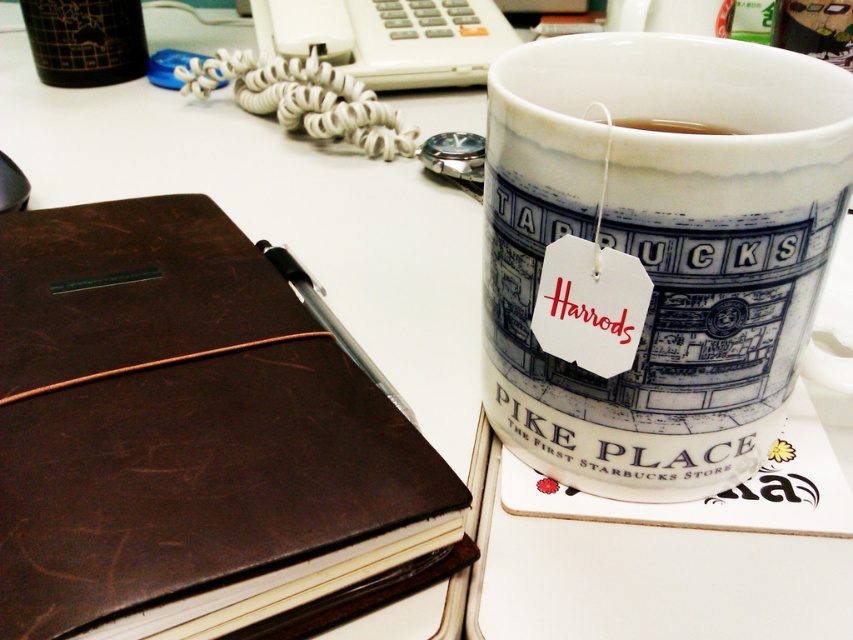
Can you confirm if brown leather notebook at left is shorter than white ceramic mug at upper right?

Yes, brown leather notebook at left is shorter than white ceramic mug at upper right.

Is point (199, 307) closer to camera compared to point (607, 161)?

No, it is behind (607, 161).

At what (x,y) coordinates should I click in order to perform the action: click on brown leather notebook at left. Please return your answer as a coordinate pair (x, y). This screenshot has height=640, width=853. Looking at the image, I should click on (186, 435).

Is the position of white ceramic mug at upper right less distant than that of white paper tea bag at upper center?

Yes.

Between white ceramic mug at upper right and white paper tea bag at upper center, which one is positioned lower?

white ceramic mug at upper right is lower down.

Find the location of `white ceramic mug at upper right`. white ceramic mug at upper right is located at coordinates (660, 248).

Find the location of a particular element. white ceramic mug at upper right is located at coordinates (660, 248).

Locate an element on the screen. The height and width of the screenshot is (640, 853). brown leather notebook at left is located at coordinates (186, 435).

Locate an element on the screen. brown leather notebook at left is located at coordinates (186, 435).

Where is `brown leather notebook at left`? brown leather notebook at left is located at coordinates (186, 435).